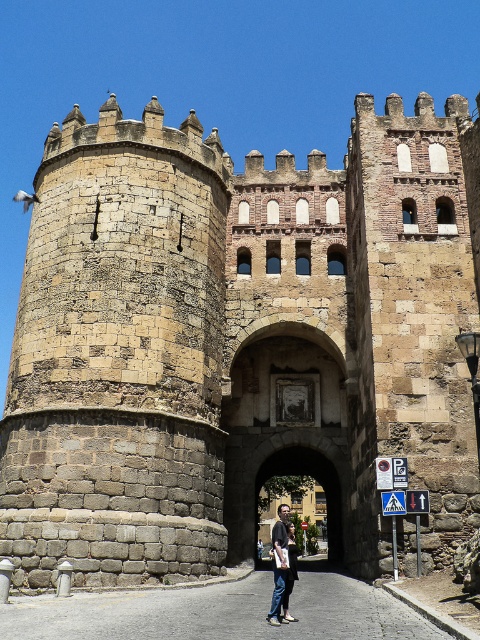
Question: Is stone archway at center below dark gray fabric jacket at center?

Choices:
 (A) no
 (B) yes

Answer: (B)

Question: Can you confirm if stone archway at center is positioned to the left of dark gray fabric jacket at center?

Choices:
 (A) no
 (B) yes

Answer: (A)

Question: Which point is closer to the camera?

Choices:
 (A) dark gray fabric jacket at center
 (B) stone archway at center

Answer: (A)

Question: Which object appears closest to the camera in this image?

Choices:
 (A) stone archway at center
 (B) dark gray fabric jacket at center

Answer: (B)

Question: Does stone archway at center have a larger size compared to dark gray fabric jacket at center?

Choices:
 (A) yes
 (B) no

Answer: (B)